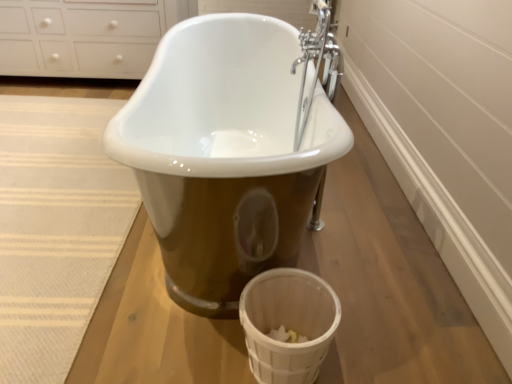
Question: Can you confirm if beige woven rug at lower left is shorter than white glossy cabinet at upper left?

Choices:
 (A) no
 (B) yes

Answer: (B)

Question: From a real-world perspective, is beige woven rug at lower left located beneath white glossy cabinet at upper left?

Choices:
 (A) no
 (B) yes

Answer: (B)

Question: Is beige woven rug at lower left oriented away from white glossy cabinet at upper left?

Choices:
 (A) yes
 (B) no

Answer: (A)

Question: Is beige woven rug at lower left facing towards white glossy cabinet at upper left?

Choices:
 (A) no
 (B) yes

Answer: (A)

Question: From the image's perspective, is beige woven rug at lower left under white glossy cabinet at upper left?

Choices:
 (A) yes
 (B) no

Answer: (A)

Question: Is beige woven rug at lower left not near white glossy cabinet at upper left?

Choices:
 (A) yes
 (B) no

Answer: (A)

Question: From the image's perspective, does white glossy cabinet at upper left appear lower than white woven basket at lower right?

Choices:
 (A) no
 (B) yes

Answer: (A)

Question: Is white glossy cabinet at upper left further to the viewer compared to white woven basket at lower right?

Choices:
 (A) no
 (B) yes

Answer: (B)

Question: Is white glossy cabinet at upper left directly adjacent to white woven basket at lower right?

Choices:
 (A) no
 (B) yes

Answer: (A)

Question: Considering the relative positions of white glossy cabinet at upper left and white woven basket at lower right in the image provided, is white glossy cabinet at upper left to the left of white woven basket at lower right from the viewer's perspective?

Choices:
 (A) no
 (B) yes

Answer: (B)

Question: Is white glossy cabinet at upper left positioned with its back to white woven basket at lower right?

Choices:
 (A) yes
 (B) no

Answer: (B)

Question: Is white glossy cabinet at upper left shorter than white woven basket at lower right?

Choices:
 (A) no
 (B) yes

Answer: (A)

Question: Is beige woven rug at lower left bigger than white woven basket at lower right?

Choices:
 (A) no
 (B) yes

Answer: (B)